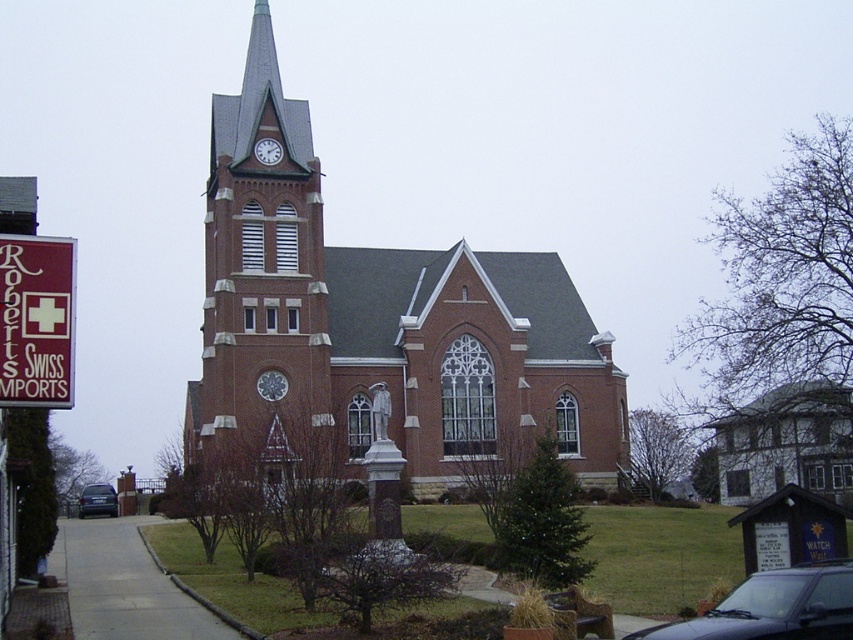
Can you confirm if brick church at center is taller than brick steeple at center?

Indeed, brick church at center has a greater height compared to brick steeple at center.

Does brick church at center appear on the right side of brick steeple at center?

Correct, you'll find brick church at center to the right of brick steeple at center.

What are the coordinates of `brick church at center` in the screenshot? It's located at (384, 317).

Identify the location of brick church at center. (384, 317).

Who is positioned more to the left, brick steeple at center or white wooden clock at upper center?

Positioned to the left is brick steeple at center.

Does brick steeple at center come behind white wooden clock at upper center?

No, it is not.

You are a GUI agent. You are given a task and a screenshot of the screen. Output one action in this format:
    pyautogui.click(x=<x>, y=<y>)
    Task: Click on the brick steeple at center
    This screenshot has height=640, width=853.
    Given the screenshot: What is the action you would take?
    pyautogui.click(x=260, y=260)

Between brick steeple at center and metallic blue sedan at center, which one appears on the right side from the viewer's perspective?

From the viewer's perspective, brick steeple at center appears more on the right side.

Does brick steeple at center appear under metallic blue sedan at center?

No, brick steeple at center is not below metallic blue sedan at center.

Where is `brick steeple at center`? This screenshot has width=853, height=640. brick steeple at center is located at coordinates (260, 260).